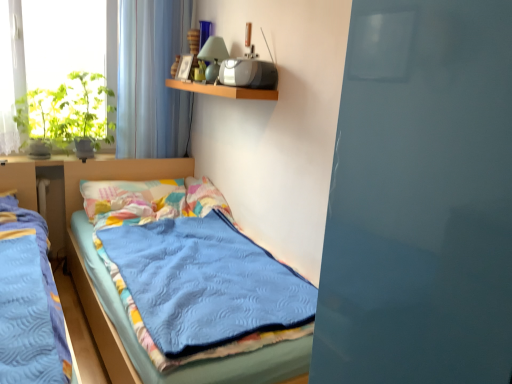
Question: Based on their positions, is green leafy plant at left, arranged as the second plant when viewed from the left, located to the left or right of wooden shelf at upper center?

Choices:
 (A) left
 (B) right

Answer: (A)

Question: From the image's perspective, is green leafy plant at left, arranged as the second plant when viewed from the left, located above or below wooden shelf at upper center?

Choices:
 (A) above
 (B) below

Answer: (B)

Question: Which of these objects is positioned farthest from the translucent fabric curtain at upper left?

Choices:
 (A) transparent glass window at upper left
 (B) matte green glass lamp at upper center
 (C) green leafy plant at left, the 1th plant viewed from the left
 (D) blue quilted bed at center
 (E) green leafy plant at left, the first plant viewed from the right

Answer: (D)

Question: Based on their relative distances, which object is nearer to the multicolored fabric pillow at center?

Choices:
 (A) translucent fabric curtain at upper left
 (B) wooden shelf at upper center
 (C) blue quilted bed at center
 (D) transparent glass window at upper left
 (E) green leafy plant at left, the first plant viewed from the right

Answer: (E)